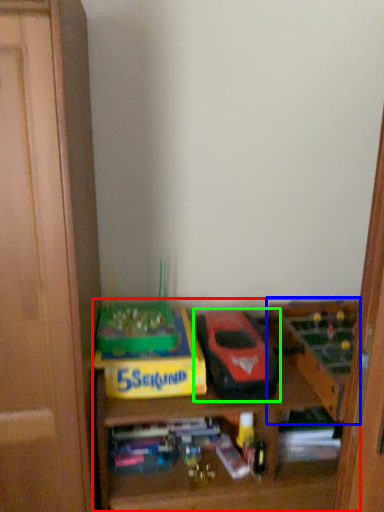
Question: Estimate the real-world distances between objects in this image. Which object is farther from shelf (highlighted by a red box), toy (highlighted by a blue box) or model car (highlighted by a green box)?

Choices:
 (A) toy
 (B) model car

Answer: (B)